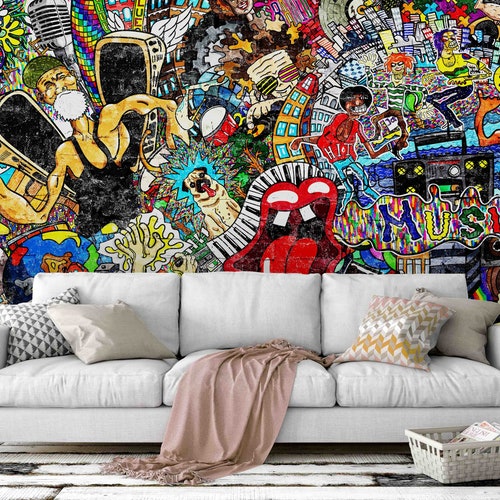
Locate an element on the screen. Image resolution: width=500 pixels, height=500 pixels. base of couch is located at coordinates (344, 428).